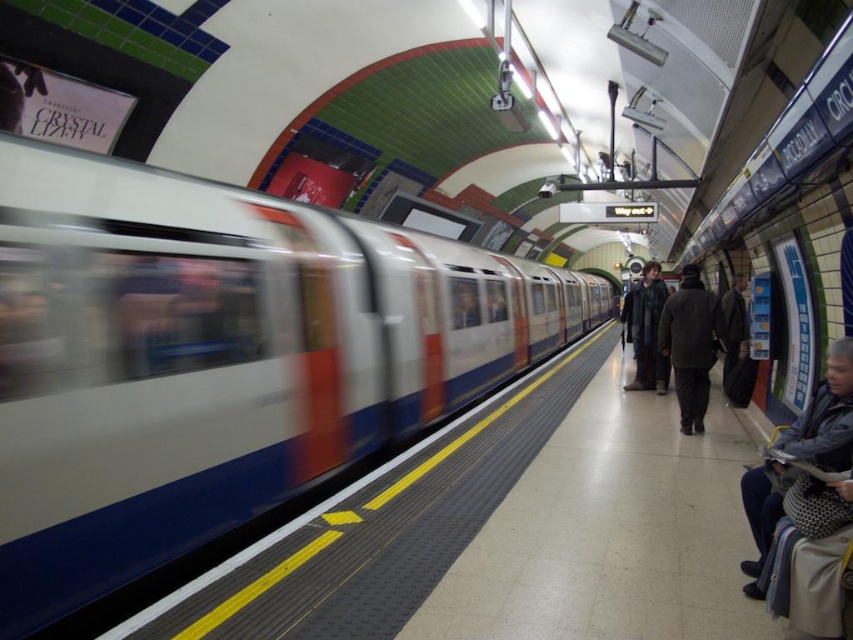
You are a commuter waiting at the London Underground station and notice two items on the platform. You see the dark gray fabric jacket at lower right and the dark brown wool coat at center. Which item is closer to the edge of the platform?

The dark gray fabric jacket at lower right is closer to the edge of the platform because it is positioned under the dark brown wool coat at center, indicating it is lower in the scene and thus nearer to the platform edge.

Based on the photo, you are a passenger waiting at the London Underground station. You notice a metallic silver train at left and a dark brown wool coat at center. Which object is positioned more to the left side of the scene?

The metallic silver train at left is positioned more to the left side of the scene compared to the dark brown wool coat at center.